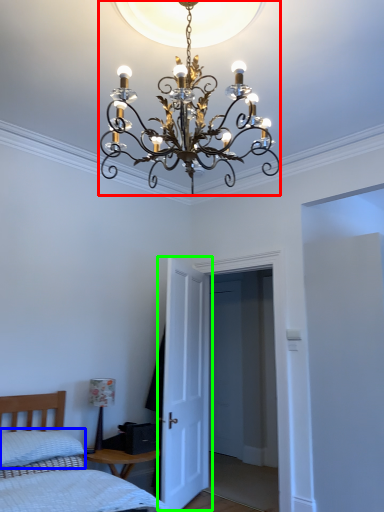
Question: Estimate the real-world distances between objects in this image. Which object is farther from lamp (highlighted by a red box), pillow (highlighted by a blue box) or door (highlighted by a green box)?

Choices:
 (A) pillow
 (B) door

Answer: (A)